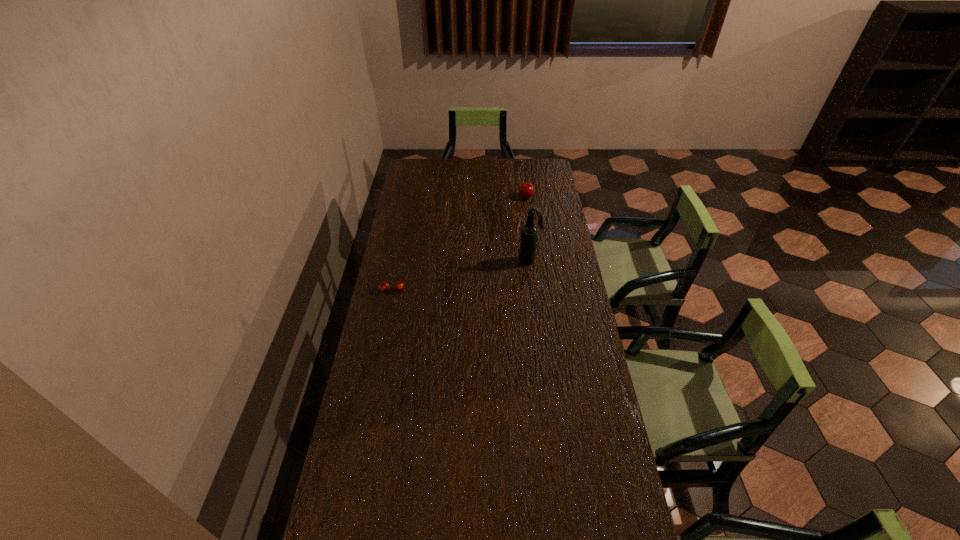
This screenshot has height=540, width=960. I want to click on beer bottle, so click(x=528, y=239).

This screenshot has height=540, width=960. What are the coordinates of `the tallest object` in the screenshot? It's located at (528, 239).

Where is `the nearest object`? the nearest object is located at coordinates (383, 286).

Locate an element on the screen. The height and width of the screenshot is (540, 960). the left cherry is located at coordinates (383, 286).

This screenshot has height=540, width=960. In order to click on the right cherry in this screenshot , I will do `click(526, 190)`.

The height and width of the screenshot is (540, 960). I want to click on the farthest object, so click(526, 190).

Where is `free space located 0.160m on the front of the tallest object`? Image resolution: width=960 pixels, height=540 pixels. free space located 0.160m on the front of the tallest object is located at coordinates (534, 293).

Find the location of `free spot located 0.350m with stems pointing upwards on the nearest object`. free spot located 0.350m with stems pointing upwards on the nearest object is located at coordinates (377, 367).

The height and width of the screenshot is (540, 960). What are the coordinates of `free region located 0.380m on the front of the farther cherry` in the screenshot? It's located at (533, 250).

You are a GUI agent. You are given a task and a screenshot of the screen. Output one action in this format:
    pyautogui.click(x=<x>, y=<y>)
    Task: Click on the object at the left edge
    
    Given the screenshot: What is the action you would take?
    pyautogui.click(x=383, y=286)